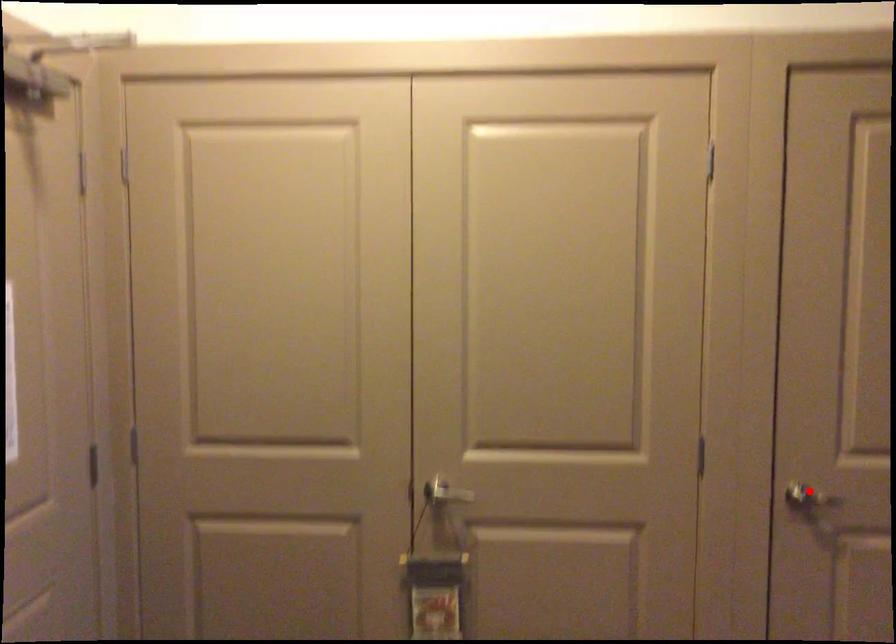
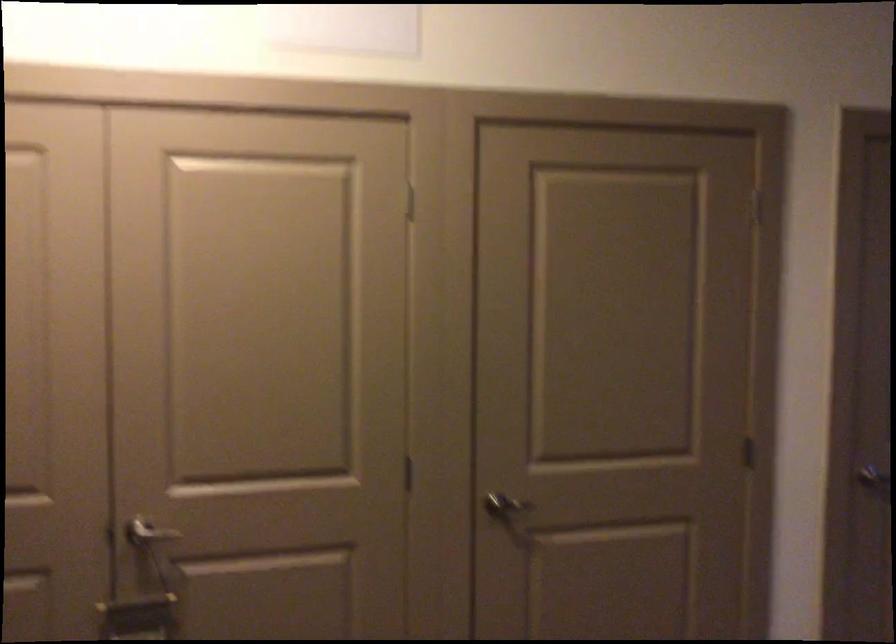
The point at the highlighted location is marked in the first image. Where is the corresponding point in the second image?

(504, 506)